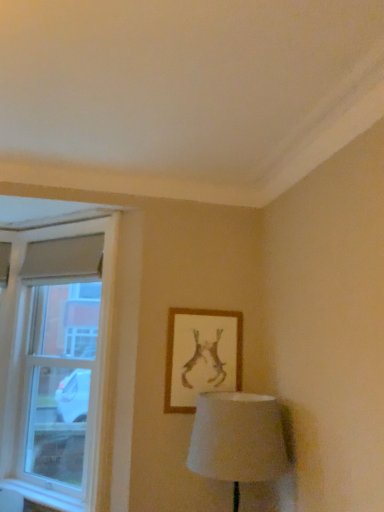
Question: In terms of height, does white glass window at left look taller or shorter compared to wooden framed artwork at upper center?

Choices:
 (A) short
 (B) tall

Answer: (B)

Question: From a real-world perspective, is white glass window at left above or below wooden framed artwork at upper center?

Choices:
 (A) above
 (B) below

Answer: (A)

Question: Which of these objects is positioned farthest from the white glass window at left?

Choices:
 (A) white plastic window sill at lower left
 (B) wooden framed artwork at upper center

Answer: (B)

Question: Considering the real-world distances, which object is closest to the white plastic window sill at lower left?

Choices:
 (A) wooden framed artwork at upper center
 (B) white glass window at left

Answer: (B)